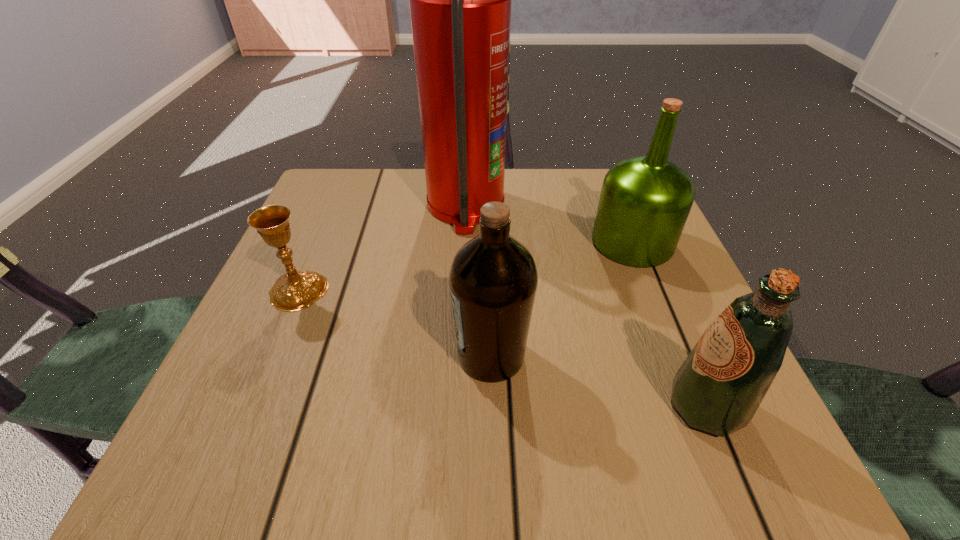
Locate an element on the screen. vacant space at the far left corner of the desktop is located at coordinates click(380, 173).

In the image, there is a desktop. Where is `vacant space at the near right corner`? vacant space at the near right corner is located at coordinates (777, 457).

The width and height of the screenshot is (960, 540). Find the location of `unoccupied position between the farthest olive oil and the leftmost olive oil`. unoccupied position between the farthest olive oil and the leftmost olive oil is located at coordinates (562, 299).

Find the location of a particular element. vacant point located between the leftmost olive oil and the farthest olive oil is located at coordinates (562, 299).

Where is `free space between the leftmost olive oil and the leftmost object`? The image size is (960, 540). free space between the leftmost olive oil and the leftmost object is located at coordinates (395, 323).

Where is `free point between the farthest olive oil and the leftmost olive oil`? free point between the farthest olive oil and the leftmost olive oil is located at coordinates (562, 299).

Select which object appears as the third closest to the leftmost olive oil. Please provide its 2D coordinates. Your answer should be formatted as a tuple, i.e. [(x, y)], where the tuple contains the x and y coordinates of a point satisfying the conditions above.

[(460, 0)]

Where is `object identified as the closest to the farthest olive oil`? The image size is (960, 540). object identified as the closest to the farthest olive oil is located at coordinates (460, 0).

At what (x,y) coordinates should I click in order to perform the action: click on the second closest olive oil to the tallest object. Please return your answer as a coordinate pair (x, y). Looking at the image, I should click on point(493,278).

Identify which olive oil is the nearest to the leftmost olive oil. Please provide its 2D coordinates. Your answer should be formatted as a tuple, i.e. [(x, y)], where the tuple contains the x and y coordinates of a point satisfying the conditions above.

[(720, 385)]